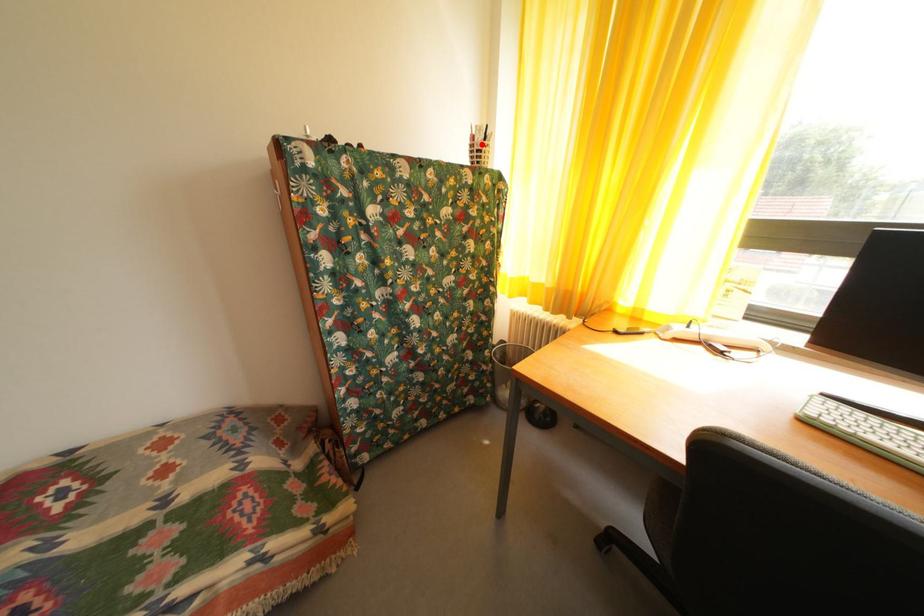
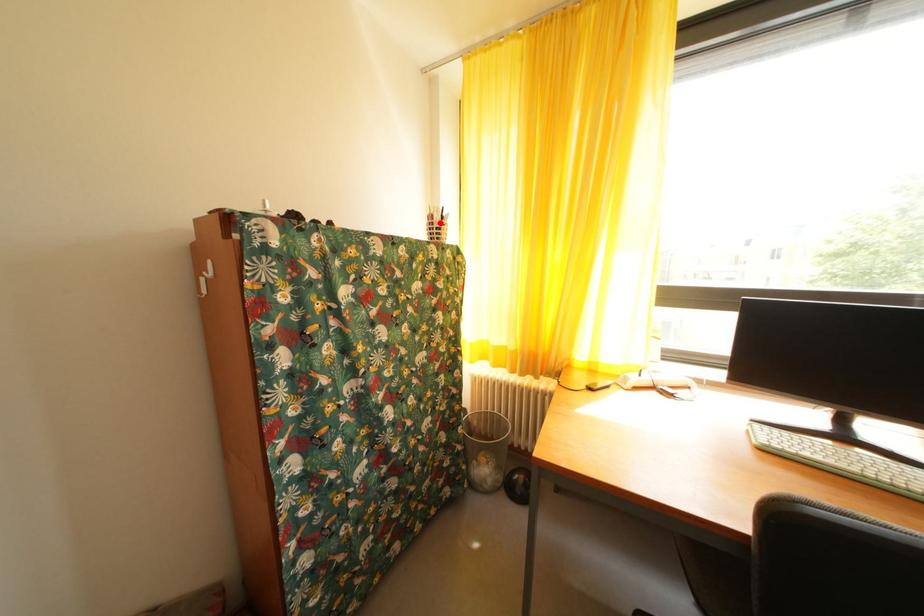
I am providing you with two images of the same scene from different viewpoints. A red point is marked on the first image and another point is marked on the second image. Does the point marked in image1 correspond to the same location as the one in image2?

Yes